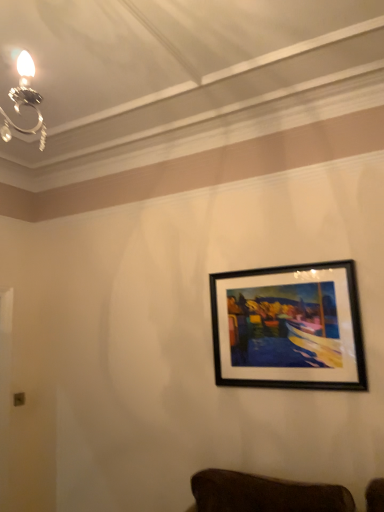
What is the approximate height of black matte picture frame at center?

It is 28.42 inches.

Identify the location of black matte picture frame at center. The height and width of the screenshot is (512, 384). (288, 328).

The width and height of the screenshot is (384, 512). What do you see at coordinates (288, 328) in the screenshot? I see `black matte picture frame at center` at bounding box center [288, 328].

Where is `black matte picture frame at center`? Image resolution: width=384 pixels, height=512 pixels. black matte picture frame at center is located at coordinates (288, 328).